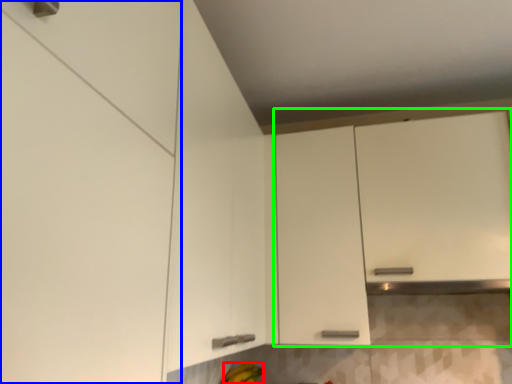
Question: Based on their relative distances, which object is nearer to banana (highlighted by a red box)? Choose from cabinetry (highlighted by a blue box) and cabinetry (highlighted by a green box).

Choices:
 (A) cabinetry
 (B) cabinetry

Answer: (B)